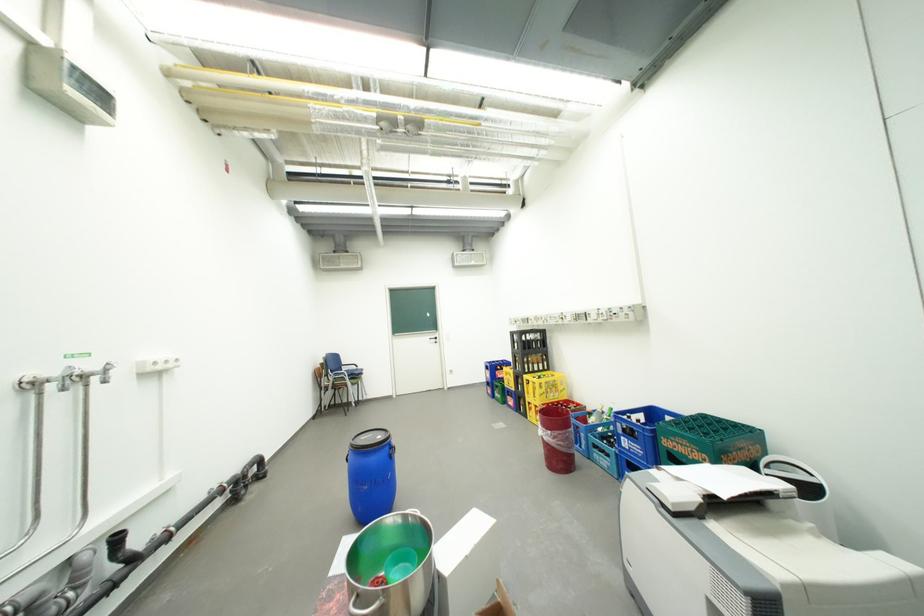
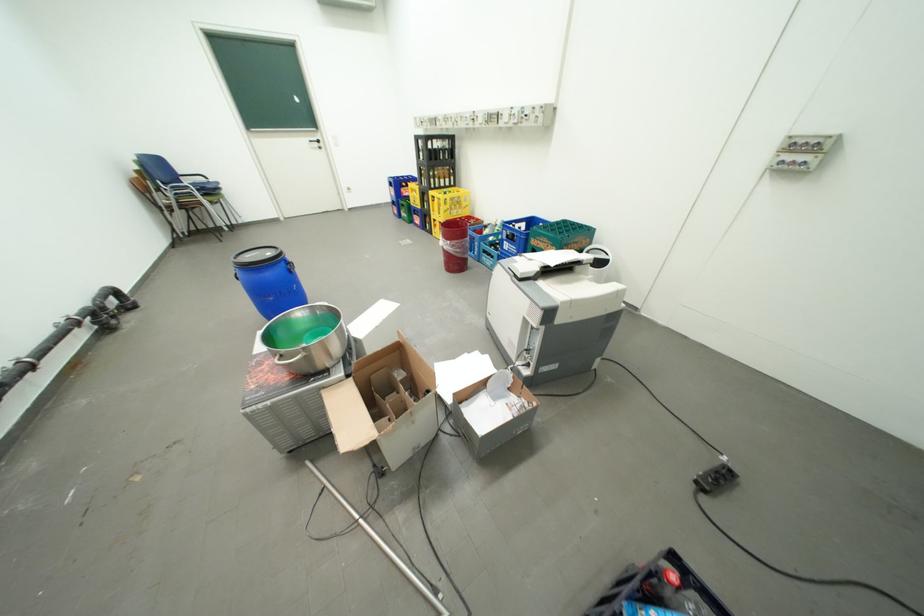
Where in the second image is the point corresponding to [647,454] from the first image?

(523, 253)